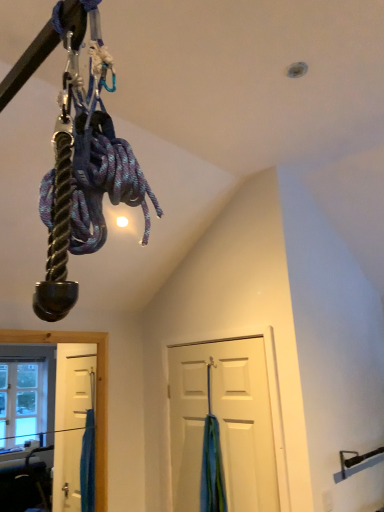
Question: Is blue fabric at door at the back of white matte door at center?

Choices:
 (A) yes
 (B) no

Answer: (A)

Question: Could you tell me if white matte door at center is facing blue fabric at door?

Choices:
 (A) no
 (B) yes

Answer: (B)

Question: From a real-world perspective, is white matte door at center located beneath blue fabric at door?

Choices:
 (A) no
 (B) yes

Answer: (A)

Question: Does white matte door at center have a smaller size compared to blue fabric at door?

Choices:
 (A) yes
 (B) no

Answer: (B)

Question: Does white matte door at center have a greater height compared to blue fabric at door?

Choices:
 (A) no
 (B) yes

Answer: (B)

Question: Does white matte door at center lie behind blue fabric at door?

Choices:
 (A) no
 (B) yes

Answer: (A)

Question: Does blue fabric at door have a lesser width compared to white matte door at center?

Choices:
 (A) no
 (B) yes

Answer: (A)

Question: Considering the relative sizes of blue fabric at door and white matte door at center in the image provided, is blue fabric at door wider than white matte door at center?

Choices:
 (A) yes
 (B) no

Answer: (A)

Question: Are blue fabric at door and white matte door at center beside each other?

Choices:
 (A) no
 (B) yes

Answer: (A)

Question: Considering the relative sizes of blue fabric at door and white matte door at center in the image provided, is blue fabric at door smaller than white matte door at center?

Choices:
 (A) no
 (B) yes

Answer: (B)

Question: Is blue fabric at door not close to white matte door at center?

Choices:
 (A) yes
 (B) no

Answer: (B)

Question: From the image's perspective, is blue fabric at door below white matte door at center?

Choices:
 (A) no
 (B) yes

Answer: (B)

Question: From the image's perspective, is white matte door at center above or below blue fabric at door?

Choices:
 (A) below
 (B) above

Answer: (B)